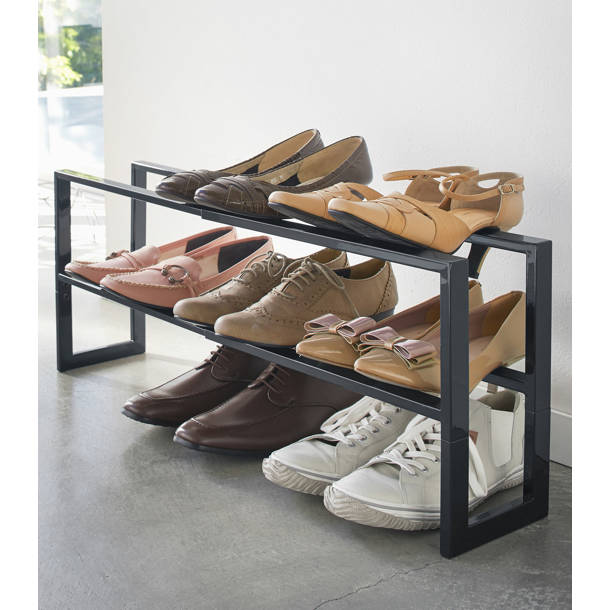
The height and width of the screenshot is (610, 610). I want to click on shoes on racks, so click(x=246, y=163), click(x=285, y=170), click(x=316, y=201), click(x=424, y=205), click(x=137, y=257), click(x=167, y=296), click(x=206, y=301), click(x=249, y=317), click(x=338, y=345), click(x=400, y=366).